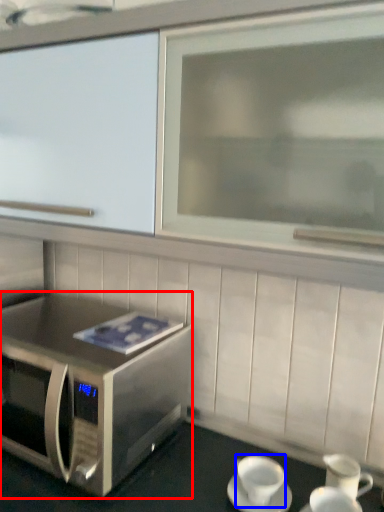
Question: Among these objects, which one is farthest to the camera, microwave oven (highlighted by a red box) or coffee cup (highlighted by a blue box)?

Choices:
 (A) microwave oven
 (B) coffee cup

Answer: (B)